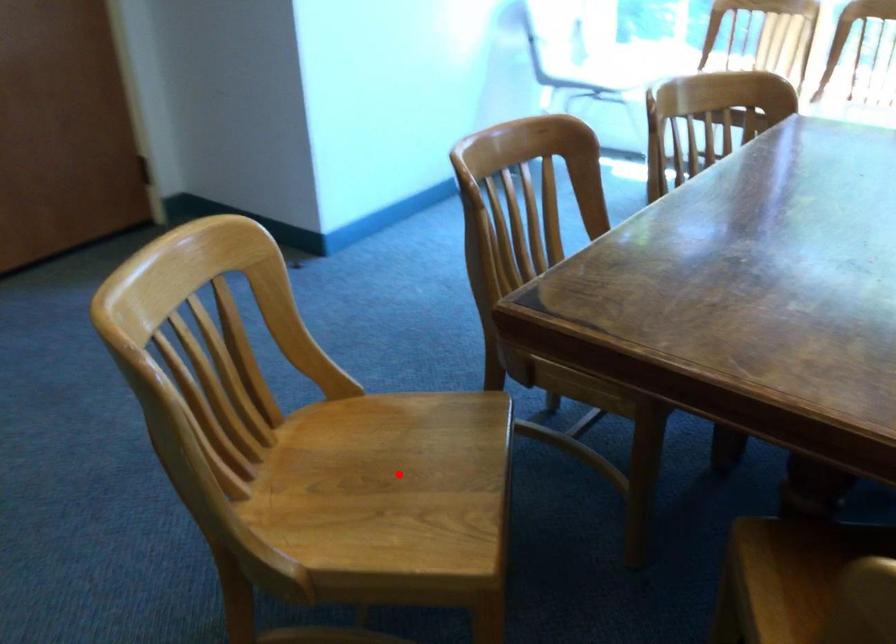
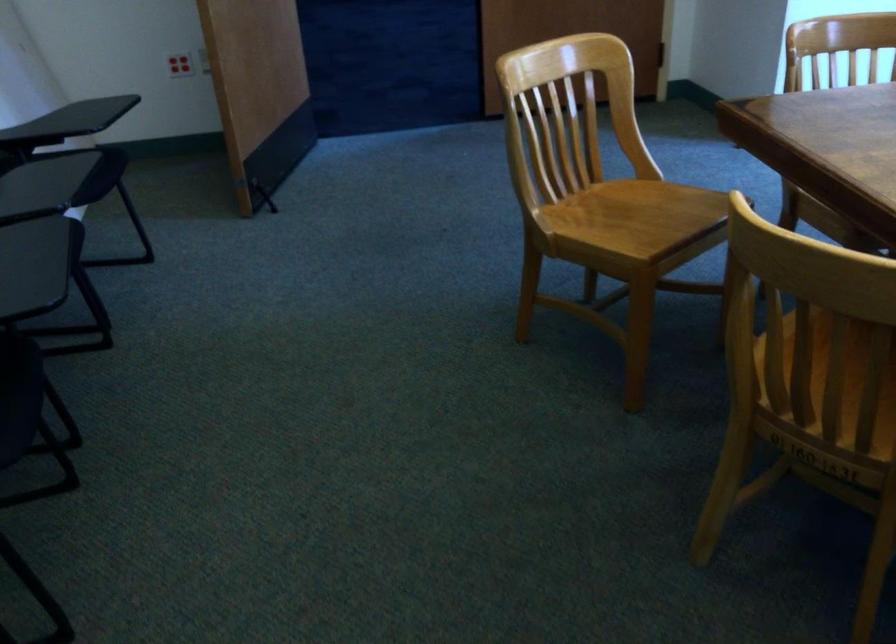
The point at the highlighted location is marked in the first image. Where is the corresponding point in the second image?

(640, 216)